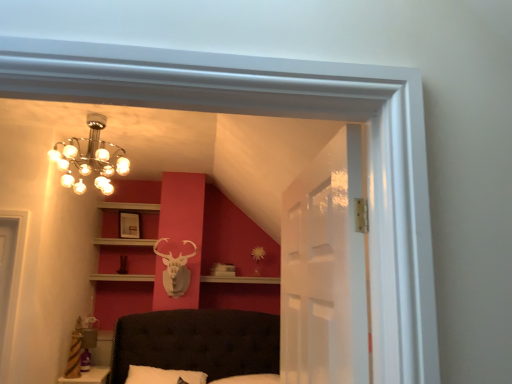
What is the approximate height of transparent glass door at center?

transparent glass door at center is 30.15 inches in height.

You are a GUI agent. You are given a task and a screenshot of the screen. Output one action in this format:
    pyautogui.click(x=<x>, y=<y>)
    Task: Click on the metallic chandelier at upper left
    The image size is (512, 384).
    Given the screenshot: What is the action you would take?
    pyautogui.click(x=90, y=158)

Considering the sizes of objects matte white picture frame at upper center and metallic chandelier at upper left in the image provided, who is shorter, matte white picture frame at upper center or metallic chandelier at upper left?

matte white picture frame at upper center.

Is matte white picture frame at upper center not within metallic chandelier at upper left?

Indeed, matte white picture frame at upper center is completely outside metallic chandelier at upper left.

Is matte white picture frame at upper center in front of or behind metallic chandelier at upper left in the image?

Clearly, matte white picture frame at upper center is behind metallic chandelier at upper left.

From the image's perspective, is matte white picture frame at upper center located above or below metallic chandelier at upper left?

From the image's perspective, matte white picture frame at upper center appears below metallic chandelier at upper left.

Is transparent glass door at center positioned far away from matte white picture frame at upper center?

transparent glass door at center is far away from matte white picture frame at upper center.

Is transparent glass door at center thinner than matte white picture frame at upper center?

No, transparent glass door at center is not thinner than matte white picture frame at upper center.

Could you tell me if transparent glass door at center is facing matte white picture frame at upper center?

No.

From the image's perspective, is metallic chandelier at upper left above transparent glass door at center?

Yes, from the image's perspective, metallic chandelier at upper left is over transparent glass door at center.

Is metallic chandelier at upper left in contact with transparent glass door at center?

No, metallic chandelier at upper left is not touching transparent glass door at center.

Measure the distance between metallic chandelier at upper left and transparent glass door at center.

7.96 feet.

Which point is more distant from viewer, (84, 139) or (287, 252)?

The point (84, 139) is more distant.

Would you say transparent glass door at center is to the left or to the right of metallic chandelier at upper left in the picture?

transparent glass door at center is positioned on metallic chandelier at upper left's right side.

Is transparent glass door at center in contact with metallic chandelier at upper left?

No, transparent glass door at center is not with metallic chandelier at upper left.

Which of these two, transparent glass door at center or metallic chandelier at upper left, is smaller?

transparent glass door at center.

Considering the sizes of objects transparent glass door at center and metallic chandelier at upper left in the image provided, who is shorter, transparent glass door at center or metallic chandelier at upper left?

Standing shorter between the two is metallic chandelier at upper left.

How different are the orientations of matte white picture frame at upper center and transparent glass door at center in degrees?

The facing directions of matte white picture frame at upper center and transparent glass door at center are 120 degrees apart.

Which is more to the right, matte white picture frame at upper center or transparent glass door at center?

From the viewer's perspective, transparent glass door at center appears more on the right side.

Which of these two, matte white picture frame at upper center or transparent glass door at center, is thinner?

Thinner between the two is matte white picture frame at upper center.

Considering the sizes of matte white picture frame at upper center and transparent glass door at center in the image, is matte white picture frame at upper center bigger or smaller than transparent glass door at center?

In the image, matte white picture frame at upper center appears to be smaller than transparent glass door at center.

Is metallic chandelier at upper left to the left of matte white picture frame at upper center from the viewer's perspective?

Incorrect, metallic chandelier at upper left is not on the left side of matte white picture frame at upper center.

Is matte white picture frame at upper center completely or partially inside metallic chandelier at upper left?

No, metallic chandelier at upper left does not contain matte white picture frame at upper center.

Which object is wider, metallic chandelier at upper left or matte white picture frame at upper center?

Wider between the two is metallic chandelier at upper left.

I want to click on picture frame that is behind the metallic chandelier at upper left, so click(129, 225).

Where is `glass door that is in front of the matte white picture frame at upper center`? The width and height of the screenshot is (512, 384). glass door that is in front of the matte white picture frame at upper center is located at coordinates (325, 270).

When comparing their distances from metallic chandelier at upper left, does transparent glass door at center or matte white picture frame at upper center seem further?

Based on the image, transparent glass door at center appears to be further to metallic chandelier at upper left.

Looking at the image, which one is located further to transparent glass door at center, matte white picture frame at upper center or metallic chandelier at upper left?

matte white picture frame at upper center is further to transparent glass door at center.

In the scene shown: Looking at the image, which one is located closer to matte white picture frame at upper center, transparent glass door at center or metallic chandelier at upper left?

metallic chandelier at upper left lies closer to matte white picture frame at upper center than the other object.

Considering their positions, is matte white picture frame at upper center positioned further to metallic chandelier at upper left than transparent glass door at center?

transparent glass door at center.

Based on their spatial positions, is metallic chandelier at upper left or matte white picture frame at upper center closer to transparent glass door at center?

Among the two, metallic chandelier at upper left is located nearer to transparent glass door at center.

Based on their spatial positions, is metallic chandelier at upper left or transparent glass door at center closer to matte white picture frame at upper center?

The object closer to matte white picture frame at upper center is metallic chandelier at upper left.

The image size is (512, 384). Identify the location of lamp between transparent glass door at center and matte white picture frame at upper center in the front-back direction. (90, 158).